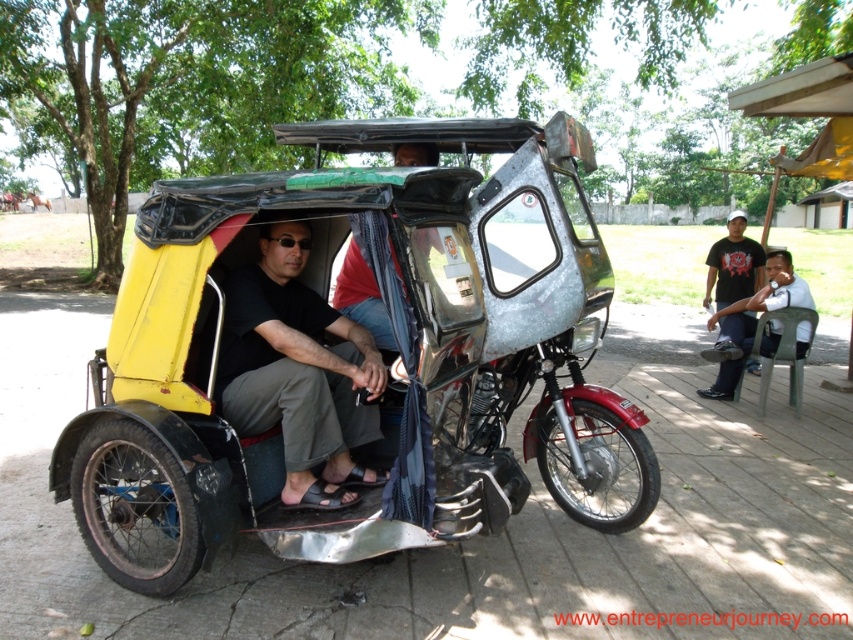
Does black matte shirt at center appear on the right side of black t-shirt at upper right?

In fact, black matte shirt at center is to the left of black t-shirt at upper right.

Is point (300, 497) closer to viewer compared to point (728, 236)?

Yes, point (300, 497) is in front of point (728, 236).

Is point (338, 323) behind point (720, 268)?

No, (338, 323) is closer to viewer.

Image resolution: width=853 pixels, height=640 pixels. What are the coordinates of `black matte shirt at center` in the screenshot? It's located at (297, 371).

Who is positioned more to the right, yellow matte tricycle at center or black matte shirt at center?

From the viewer's perspective, yellow matte tricycle at center appears more on the right side.

Is point (381, 198) in front of point (305, 252)?

Yes, point (381, 198) is closer to viewer.

What are the coordinates of `yellow matte tricycle at center` in the screenshot? It's located at (351, 356).

This screenshot has width=853, height=640. I want to click on black matte shirt at center, so click(297, 371).

In the scene shown: Which is below, black matte shirt at center or dark gray plastic chair at right?

black matte shirt at center

Find the location of `black matte shirt at center`. black matte shirt at center is located at coordinates (297, 371).